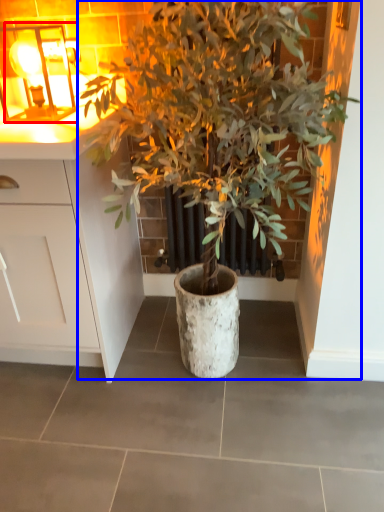
Question: Which object appears closest to the camera in this image, light fixture (highlighted by a red box) or houseplant (highlighted by a blue box)?

Choices:
 (A) light fixture
 (B) houseplant

Answer: (B)